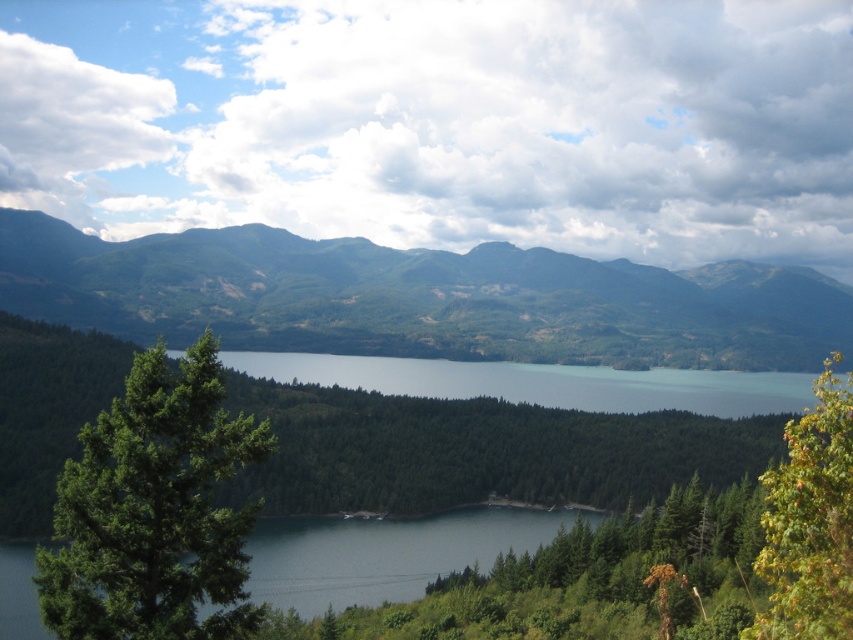
Is the position of green forested mountain at center less distant than that of yellow-green leafy tree at right?

No, it is behind yellow-green leafy tree at right.

Who is shorter, green forested mountain at center or yellow-green leafy tree at right?

Standing shorter between the two is yellow-green leafy tree at right.

I want to click on green forested mountain at center, so click(421, 298).

Is green forested mountain at center below green matte tree at left?

Actually, green forested mountain at center is above green matte tree at left.

Is point (328, 323) closer to viewer compared to point (158, 380)?

No, it is behind (158, 380).

You are a GUI agent. You are given a task and a screenshot of the screen. Output one action in this format:
    pyautogui.click(x=<x>, y=<y>)
    Task: Click on the green forested mountain at center
    This screenshot has height=640, width=853.
    Given the screenshot: What is the action you would take?
    click(421, 298)

Which is behind, point (62, 604) or point (799, 468)?

Positioned behind is point (62, 604).

Which of these two, green matte tree at left or yellow-green leafy tree at right, stands taller?

green matte tree at left is taller.

The height and width of the screenshot is (640, 853). I want to click on green matte tree at left, so click(154, 512).

At what (x,y) coordinates should I click in order to perform the action: click on green matte tree at left. Please return your answer as a coordinate pair (x, y). This screenshot has width=853, height=640. Looking at the image, I should click on (154, 512).